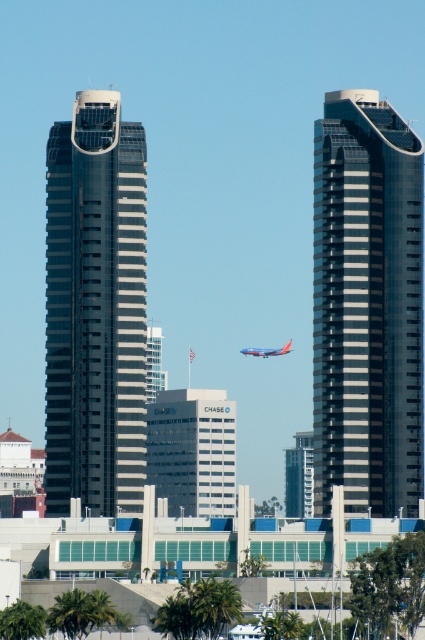
Question: Among these objects, which one is farthest from the camera?

Choices:
 (A) blue matte airplane at center
 (B) smooth glass skyscraper at center

Answer: (A)

Question: Can you confirm if smooth glass skyscraper at right is positioned above blue matte airplane at center?

Choices:
 (A) yes
 (B) no

Answer: (A)

Question: Observing the image, what is the correct spatial positioning of smooth glass skyscraper at right in reference to smooth glass skyscraper at center?

Choices:
 (A) right
 (B) left

Answer: (A)

Question: Which is nearer to the smooth glass skyscraper at center?

Choices:
 (A) metallic silver elevator shaft at center
 (B) smooth glass skyscraper at right

Answer: (A)

Question: Is smooth glass skyscraper at right in front of smooth glass skyscraper at center?

Choices:
 (A) yes
 (B) no

Answer: (B)

Question: Which object is positioned farthest from the smooth glass skyscraper at center?

Choices:
 (A) blue matte airplane at center
 (B) metallic silver elevator shaft at center
 (C) smooth glass skyscraper at right

Answer: (C)